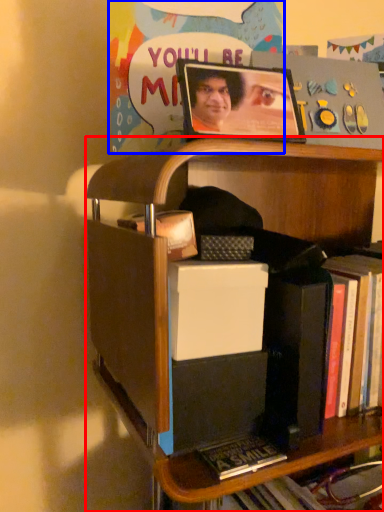
Question: Among these objects, which one is nearest to the camera, shelf (highlighted by a red box) or postcard (highlighted by a blue box)?

Choices:
 (A) shelf
 (B) postcard

Answer: (A)